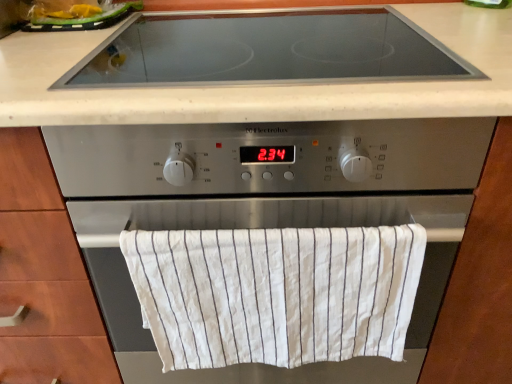
Question: Considering the positions of point tap(389, 276) and point tap(162, 200), is point tap(389, 276) closer or farther from the camera than point tap(162, 200)?

Choices:
 (A) closer
 (B) farther

Answer: (B)

Question: Is white striped cloth at center in front of or behind satin silver oven at center in the image?

Choices:
 (A) front
 (B) behind

Answer: (B)

Question: Which of these objects is positioned closest to the white striped cloth at center?

Choices:
 (A) satin silver oven at center
 (B) black glass cooktop at upper center
 (C) yellow plastic bag at upper left

Answer: (A)

Question: Which object is positioned closest to the satin silver oven at center?

Choices:
 (A) black glass cooktop at upper center
 (B) yellow plastic bag at upper left
 (C) white striped cloth at center

Answer: (C)